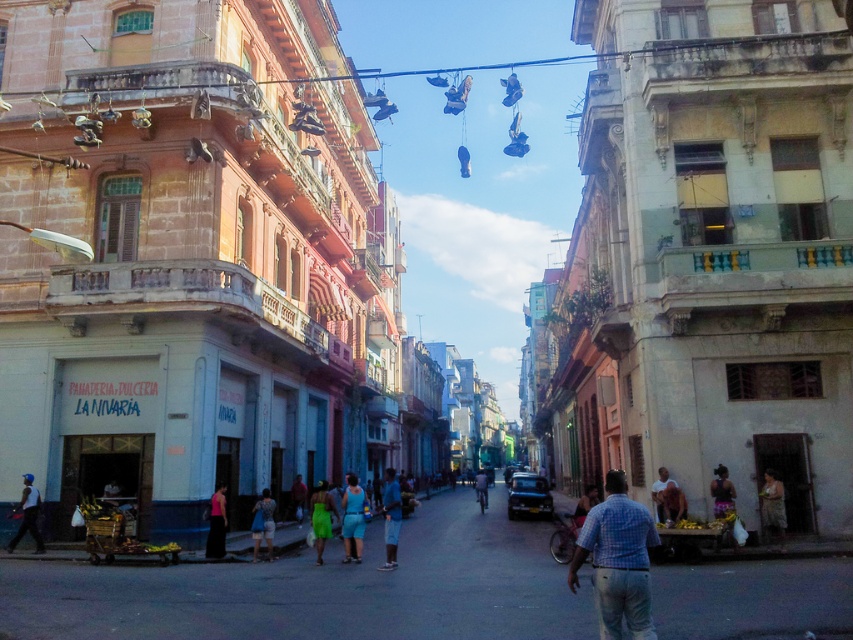
You are standing at the corner of the street and see a person wearing a checkered shirt at center. If you were to walk directly towards them, would you need to move north, south, east, or west?

Since the checkered shirt at center is located at coordinates approximately 0.877 on the x axis and 0.725 on the y axis, you would need to move west to reach them from the corner.